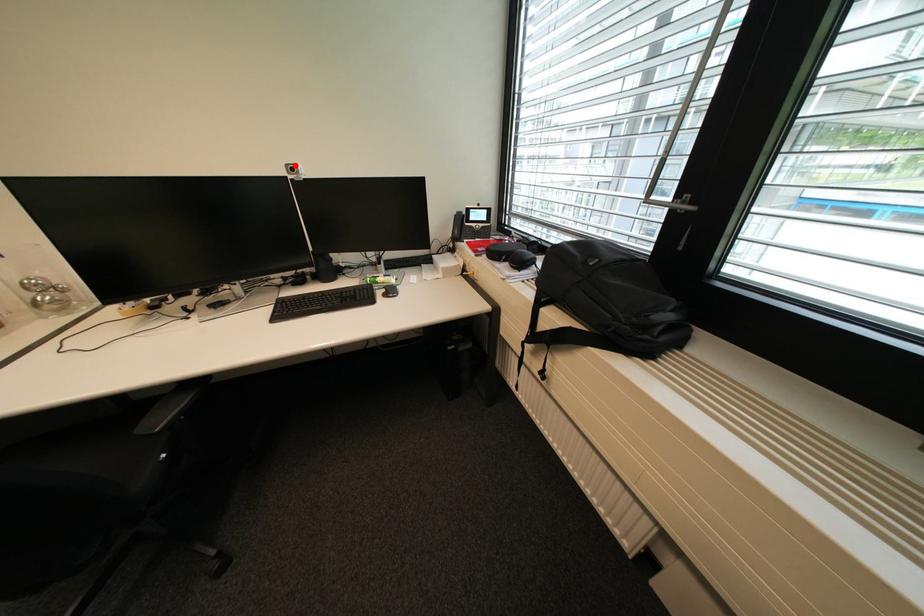
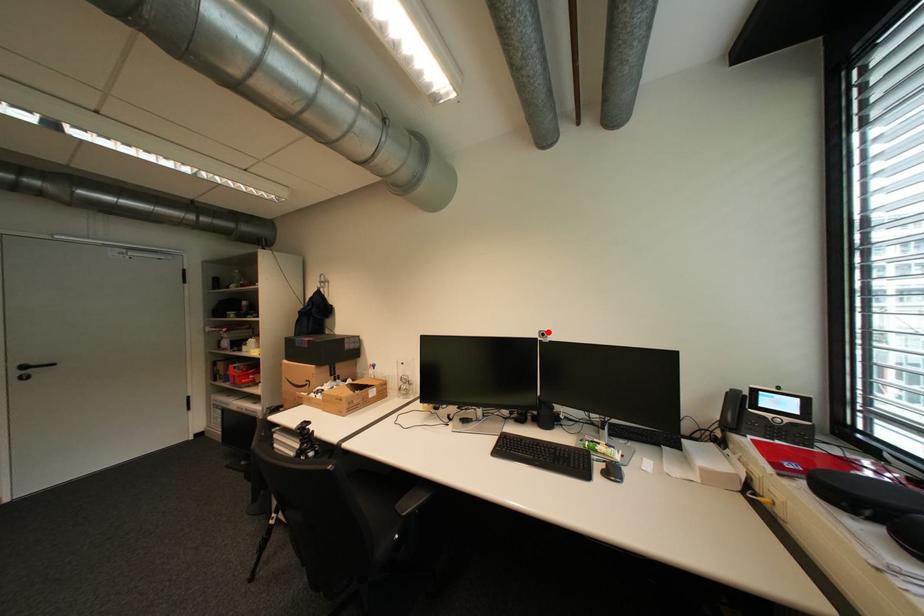
I am providing you with two images of the same scene from different viewpoints. A red point is marked on the first image and another point is marked on the second image. Are the points marked in image1 and image2 representing the same 3D position?

Yes